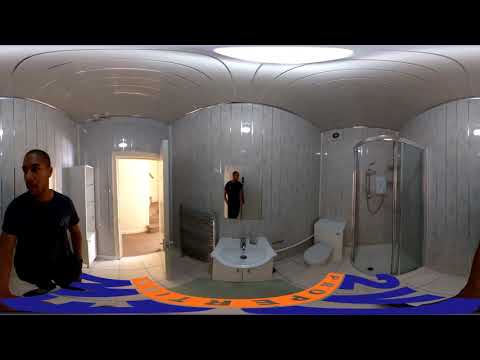
Image resolution: width=480 pixels, height=360 pixels. Identify the location of doorknob. (168, 241), (157, 239).